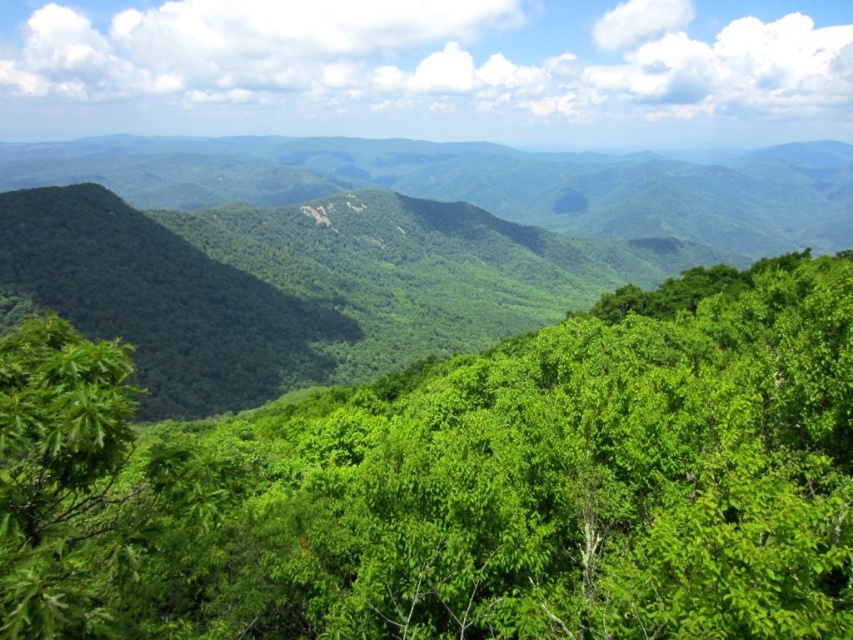
Question: Which of the following is the closest to the observer?

Choices:
 (A) (828, 545)
 (B) (103, 266)

Answer: (A)

Question: Considering the relative positions of green leafy tree at center and green leafy forest at center in the image provided, where is green leafy tree at center located with respect to green leafy forest at center?

Choices:
 (A) right
 (B) left

Answer: (B)

Question: Which point appears farthest from the camera in this image?

Choices:
 (A) (268, 563)
 (B) (451, 164)

Answer: (B)

Question: Is green leafy tree at center above green leafy forest at center?

Choices:
 (A) yes
 (B) no

Answer: (B)

Question: Is green leafy tree at center smaller than green leafy forest at center?

Choices:
 (A) no
 (B) yes

Answer: (B)